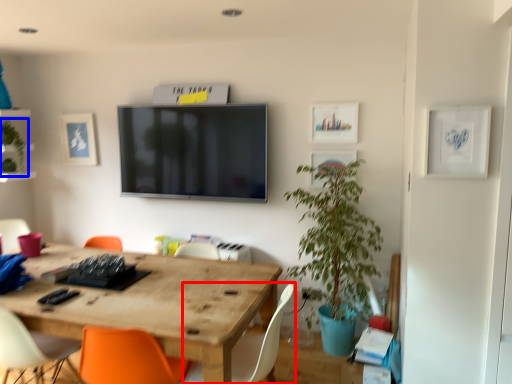
Question: Which object appears farthest to the camera in this image, chair (highlighted by a red box) or plant (highlighted by a blue box)?

Choices:
 (A) chair
 (B) plant

Answer: (B)